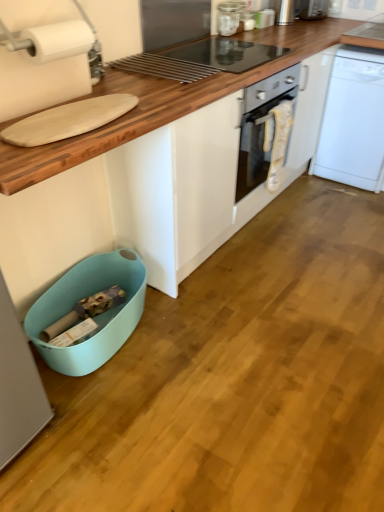
Identify the location of vacant space to the right of teal plastic dish washer at lower left. (188, 338).